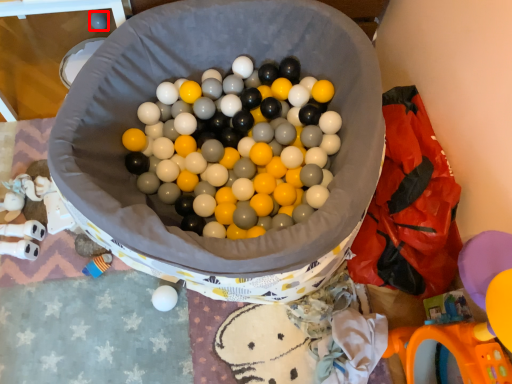
Question: From the image's perspective, what is the correct spatial relationship of toy (annotated by the red box) in relation to material?

Choices:
 (A) above
 (B) below

Answer: (A)